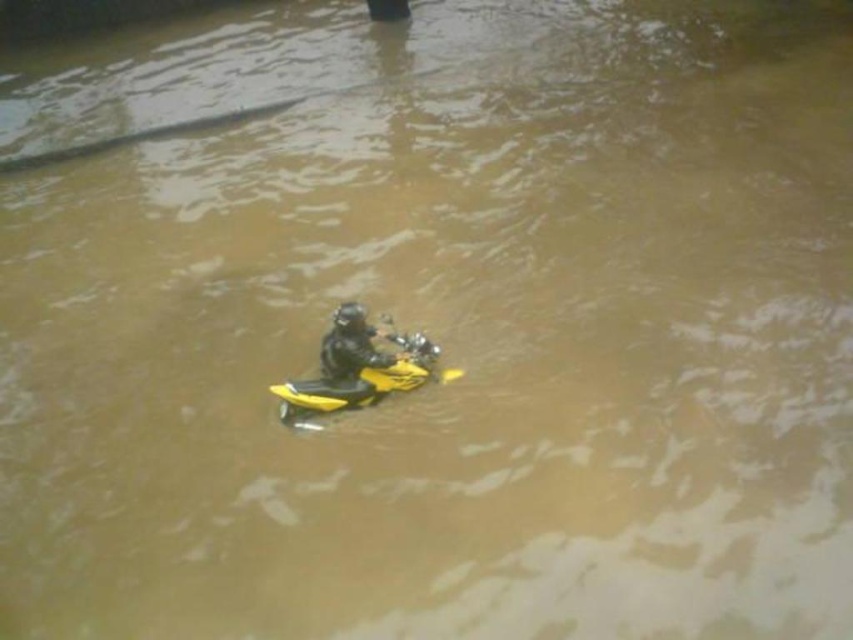
Which is behind, point (349, 356) or point (318, 356)?

Positioned behind is point (318, 356).

Between yellow matte motorcycle at center and black matte helmet at center, which one appears on the right side from the viewer's perspective?

yellow matte motorcycle at center is more to the right.

Identify the location of yellow matte motorcycle at center. Image resolution: width=853 pixels, height=640 pixels. (358, 374).